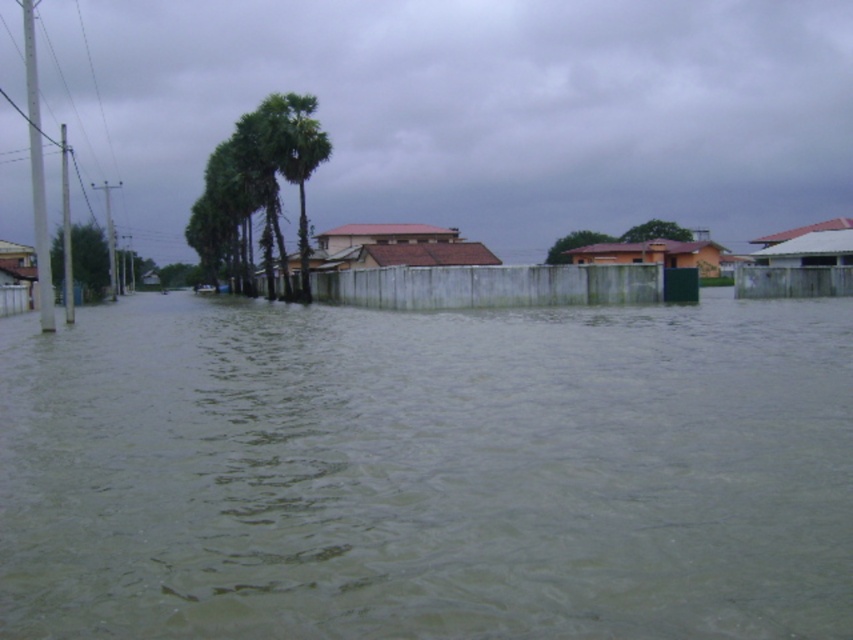
Is point (294, 368) positioned before point (264, 120)?

Yes, it is.

Does greenish murky water at center lie behind green leafy palm trees at center?

No.

Image resolution: width=853 pixels, height=640 pixels. Find the location of `greenish murky water at center`. greenish murky water at center is located at coordinates (427, 472).